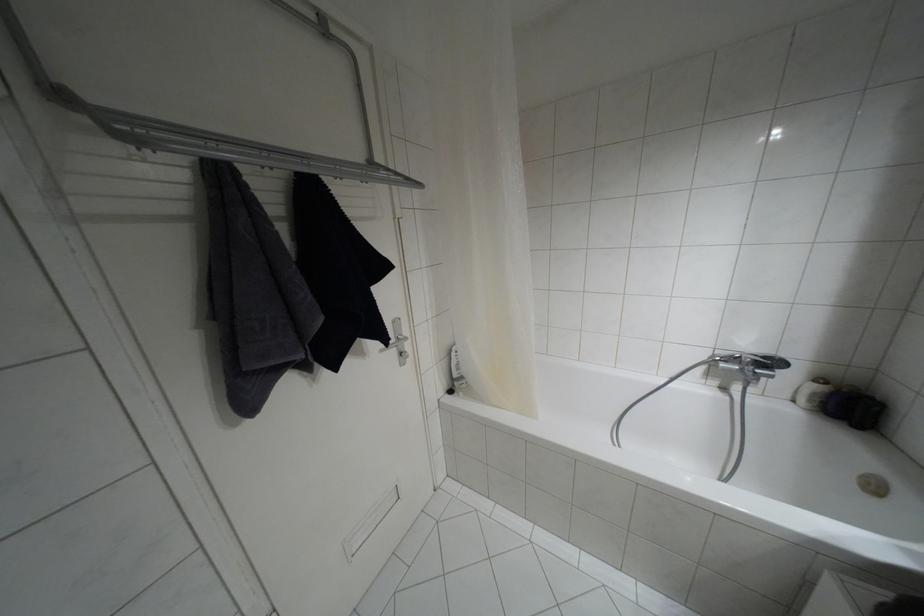
Find where to pull the silver door handle. Please return your answer as a coordinate pair (x, y).

(396, 342)